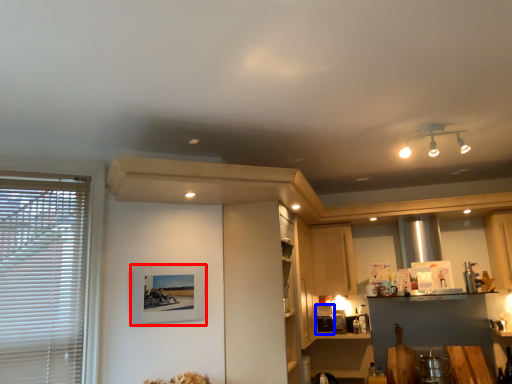
Question: Which object appears farthest to the camera in this image, picture frame (highlighted by a red box) or appliance (highlighted by a blue box)?

Choices:
 (A) picture frame
 (B) appliance

Answer: (B)